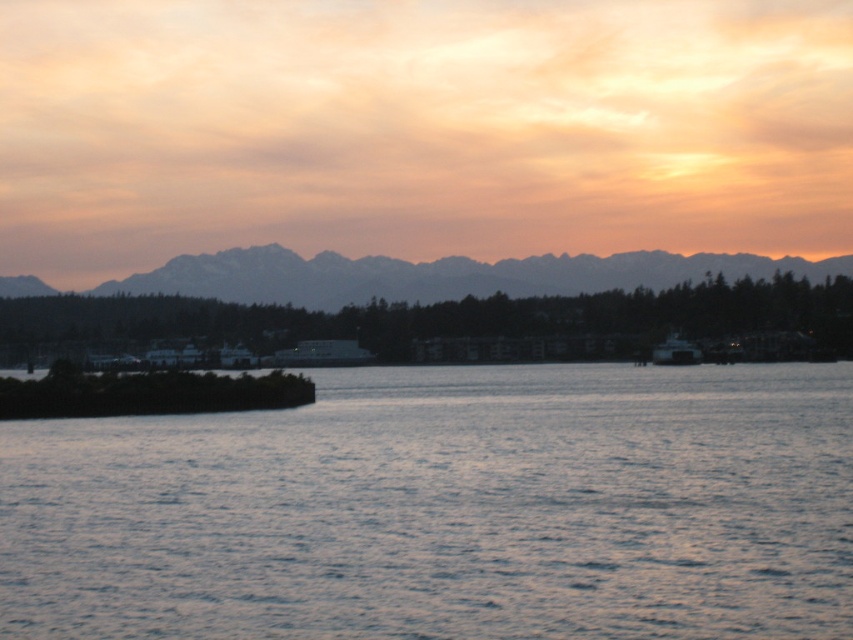
Question: Which object is the farthest from the distant gray mountains at upper center?

Choices:
 (A) blue water at center
 (B) metallic gray boat at right

Answer: (A)

Question: Can you confirm if blue water at center is positioned to the left of metallic gray boat at right?

Choices:
 (A) yes
 (B) no

Answer: (A)

Question: Can you confirm if blue water at center is positioned to the right of metallic gray boat at right?

Choices:
 (A) yes
 (B) no

Answer: (B)

Question: Which object is closer to the camera taking this photo?

Choices:
 (A) distant gray mountains at upper center
 (B) metallic gray boat at right
 (C) blue water at center

Answer: (C)

Question: Estimate the real-world distances between objects in this image. Which object is farther from the distant gray mountains at upper center?

Choices:
 (A) metallic gray boat at right
 (B) blue water at center

Answer: (B)

Question: Is distant gray mountains at upper center above metallic gray boat at right?

Choices:
 (A) no
 (B) yes

Answer: (B)